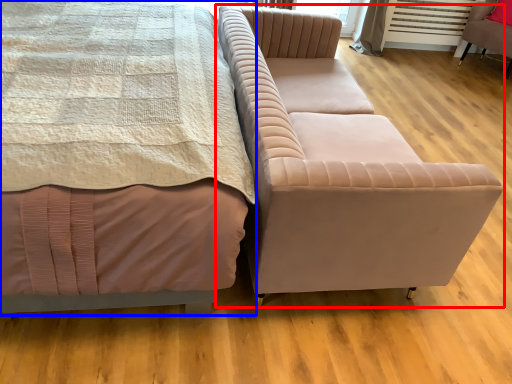
Question: Which of the following is the farthest to the observer, studio couch (highlighted by a red box) or bed (highlighted by a blue box)?

Choices:
 (A) studio couch
 (B) bed

Answer: (A)